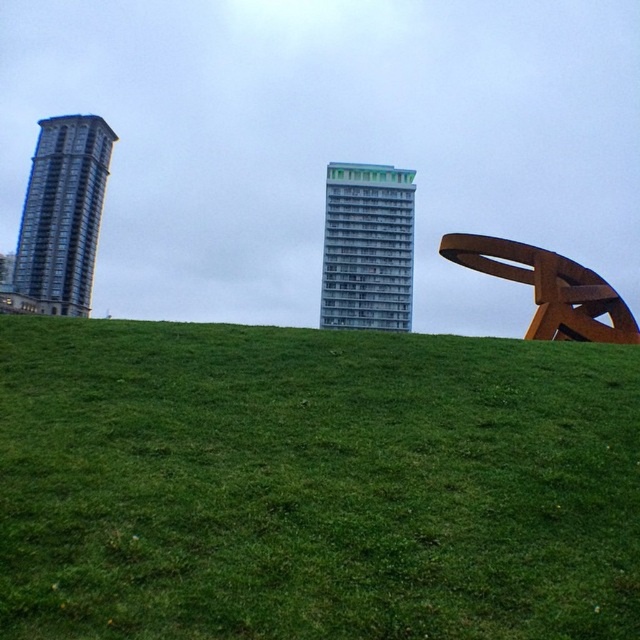
The width and height of the screenshot is (640, 640). Find the location of `green grassy at center`. green grassy at center is located at coordinates (314, 484).

Is green grassy at center to the left of green glass building at center from the viewer's perspective?

Correct, you'll find green grassy at center to the left of green glass building at center.

Find the location of a particular element. Image resolution: width=640 pixels, height=640 pixels. green grassy at center is located at coordinates (314, 484).

Can you confirm if glassy reflective building at left is wider than green glass building at center?

Correct, the width of glassy reflective building at left exceeds that of green glass building at center.

Where is `glassy reflective building at left`? The height and width of the screenshot is (640, 640). glassy reflective building at left is located at coordinates (60, 218).

This screenshot has height=640, width=640. Find the location of `glassy reflective building at left`. glassy reflective building at left is located at coordinates (60, 218).

Does green grassy at center appear over rusty metal sculpture at right?

No.

Find the location of `green grassy at center`. green grassy at center is located at coordinates (314, 484).

I want to click on green grassy at center, so click(314, 484).